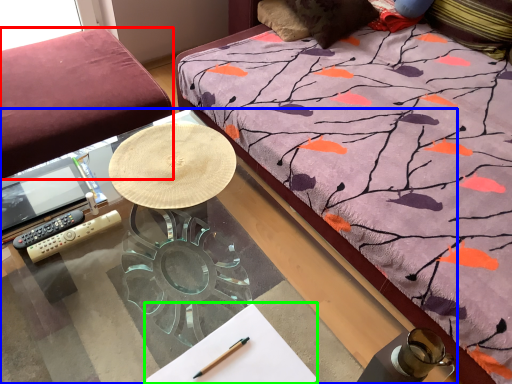
Question: Which object is positioned closest to studio couch (highlighted by a red box)? Select from desk (highlighted by a blue box) and notepad (highlighted by a green box).

Choices:
 (A) desk
 (B) notepad

Answer: (A)